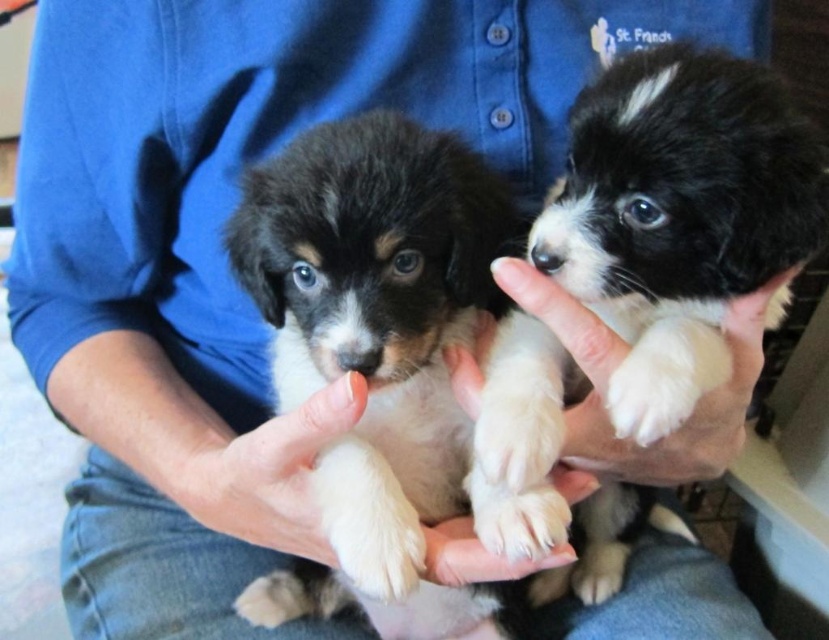
Question: Can you confirm if white soft skin at upper center is positioned below white soft paw at center?

Choices:
 (A) no
 (B) yes

Answer: (A)

Question: Is white soft skin at upper center further to camera compared to white soft paw at center?

Choices:
 (A) yes
 (B) no

Answer: (A)

Question: Which of the following is the closest to the observer?

Choices:
 (A) white soft paw at center
 (B) white soft skin at upper center

Answer: (A)

Question: Can you confirm if white soft skin at upper center is positioned to the right of white soft paw at center?

Choices:
 (A) no
 (B) yes

Answer: (B)